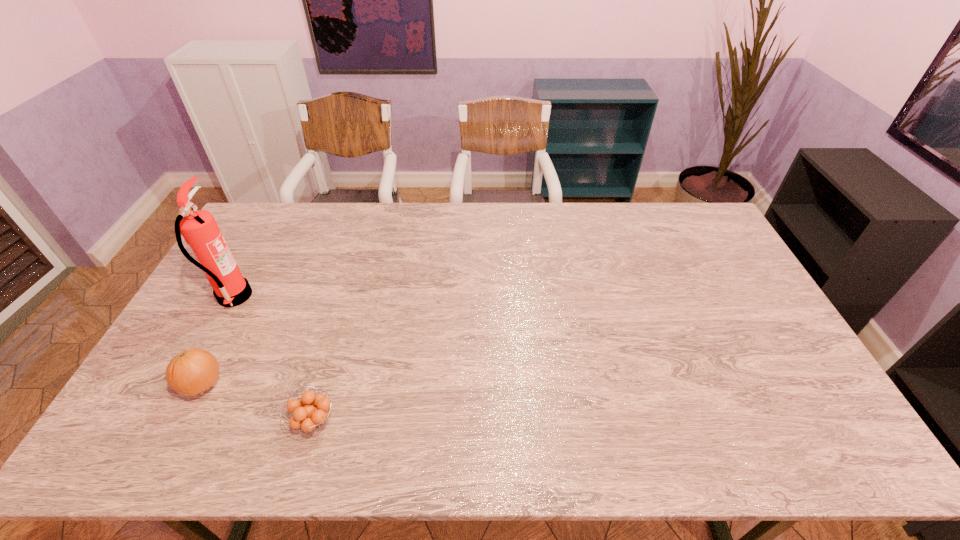
I want to click on free space that is in between the shortest object and the farthest object, so click(274, 359).

Where is `empty location between the shorter orange fruit and the fire extinguisher`? This screenshot has height=540, width=960. empty location between the shorter orange fruit and the fire extinguisher is located at coordinates (274, 359).

The height and width of the screenshot is (540, 960). Identify the location of free space between the left orange fruit and the fire extinguisher. (218, 341).

Locate an element on the screen. The image size is (960, 540). free space between the rightmost object and the taller orange fruit is located at coordinates (258, 403).

The image size is (960, 540). Find the location of `vacant area that lies between the fire extinguisher and the second tallest object`. vacant area that lies between the fire extinguisher and the second tallest object is located at coordinates (218, 341).

Find the location of `vacant space that is in between the second shortest object and the right orange fruit`. vacant space that is in between the second shortest object and the right orange fruit is located at coordinates (258, 403).

Locate an element on the screen. Image resolution: width=960 pixels, height=540 pixels. free area in between the left orange fruit and the tallest object is located at coordinates (218, 341).

Locate an element on the screen. This screenshot has height=540, width=960. empty space between the fire extinguisher and the shorter orange fruit is located at coordinates (274, 359).

The height and width of the screenshot is (540, 960). In order to click on the closest object relative to the farthest object in this screenshot , I will do `click(191, 372)`.

Identify the location of the second closest object to the shorter orange fruit. This screenshot has height=540, width=960. (199, 229).